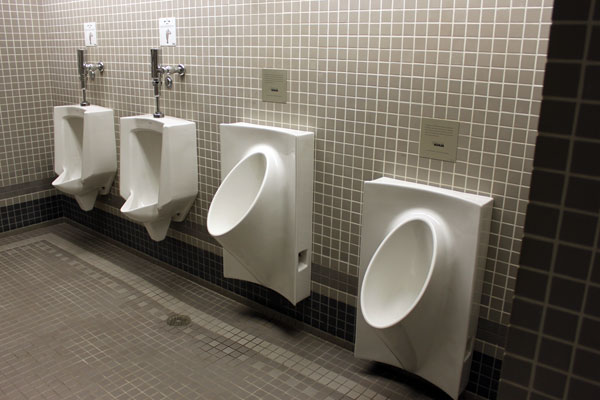
Find the location of a particular element. The height and width of the screenshot is (400, 600). urinals is located at coordinates (66, 130), (153, 159), (243, 191), (405, 243).